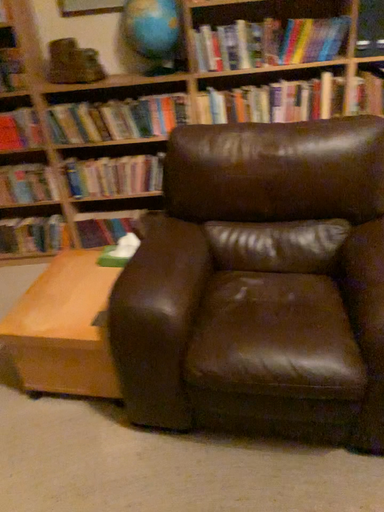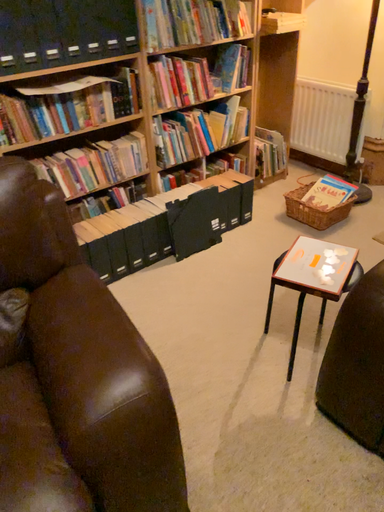
Question: Which way did the camera rotate in the video?

Choices:
 (A) rotated upward
 (B) rotated downward

Answer: (A)